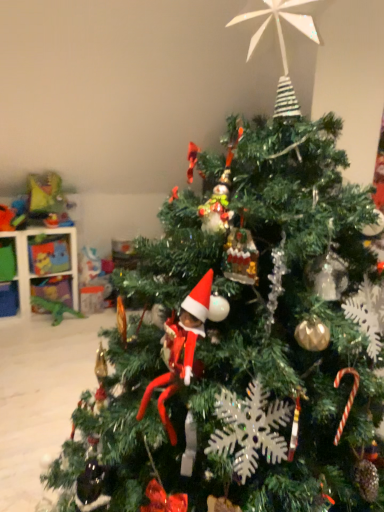
Question: From a real-world perspective, is green plastic dinosaur at lower left, marked as the first toy in a bottom-to-top arrangement, physically below white plastic shelf at left?

Choices:
 (A) yes
 (B) no

Answer: (A)

Question: Is green plastic dinosaur at lower left, the 2th toy positioned from the top, closer to camera compared to white plastic shelf at left?

Choices:
 (A) no
 (B) yes

Answer: (A)

Question: Is green plastic dinosaur at lower left, marked as the first toy in a bottom-to-top arrangement, not close to white plastic shelf at left?

Choices:
 (A) no
 (B) yes

Answer: (A)

Question: Is green plastic dinosaur at lower left, marked as the first toy in a bottom-to-top arrangement, at the left side of white plastic shelf at left?

Choices:
 (A) yes
 (B) no

Answer: (B)

Question: Is green plastic dinosaur at lower left, the 2th toy positioned from the top, oriented towards white plastic shelf at left?

Choices:
 (A) yes
 (B) no

Answer: (B)

Question: Would you say white plastic shelf at left is to the left or to the right of green plastic dinosaur at lower left, marked as the first toy in a bottom-to-top arrangement, in the picture?

Choices:
 (A) right
 (B) left

Answer: (B)

Question: Looking at the image, does white plastic shelf at left seem bigger or smaller compared to green plastic dinosaur at lower left, marked as the first toy in a bottom-to-top arrangement?

Choices:
 (A) small
 (B) big

Answer: (B)

Question: In terms of height, does white plastic shelf at left look taller or shorter compared to green plastic dinosaur at lower left, marked as the first toy in a bottom-to-top arrangement?

Choices:
 (A) tall
 (B) short

Answer: (A)

Question: From a real-world perspective, relative to green plastic dinosaur at lower left, marked as the first toy in a bottom-to-top arrangement, is white plastic shelf at left vertically above or below?

Choices:
 (A) below
 (B) above

Answer: (B)

Question: Based on their sizes in the image, would you say green plastic dinosaur at lower left, the 2th toy positioned from the top, is bigger or smaller than plastic dinosaur at upper left, the first toy viewed from the top?

Choices:
 (A) big
 (B) small

Answer: (B)

Question: From a real-world perspective, is green plastic dinosaur at lower left, marked as the first toy in a bottom-to-top arrangement, above or below plastic dinosaur at upper left, which ranks as the second toy in bottom-to-top order?

Choices:
 (A) below
 (B) above

Answer: (A)

Question: Is point (34, 306) positioned closer to the camera than point (71, 222)?

Choices:
 (A) farther
 (B) closer

Answer: (A)

Question: Considering the positions of green plastic dinosaur at lower left, marked as the first toy in a bottom-to-top arrangement, and plastic dinosaur at upper left, which ranks as the second toy in bottom-to-top order, in the image, is green plastic dinosaur at lower left, marked as the first toy in a bottom-to-top arrangement, taller or shorter than plastic dinosaur at upper left, which ranks as the second toy in bottom-to-top order,?

Choices:
 (A) short
 (B) tall

Answer: (A)

Question: Does point (44, 202) appear closer or farther from the camera than point (51, 244)?

Choices:
 (A) farther
 (B) closer

Answer: (B)

Question: Is plastic dinosaur at upper left, the first toy viewed from the top, inside or outside of white plastic shelf at left?

Choices:
 (A) outside
 (B) inside

Answer: (A)